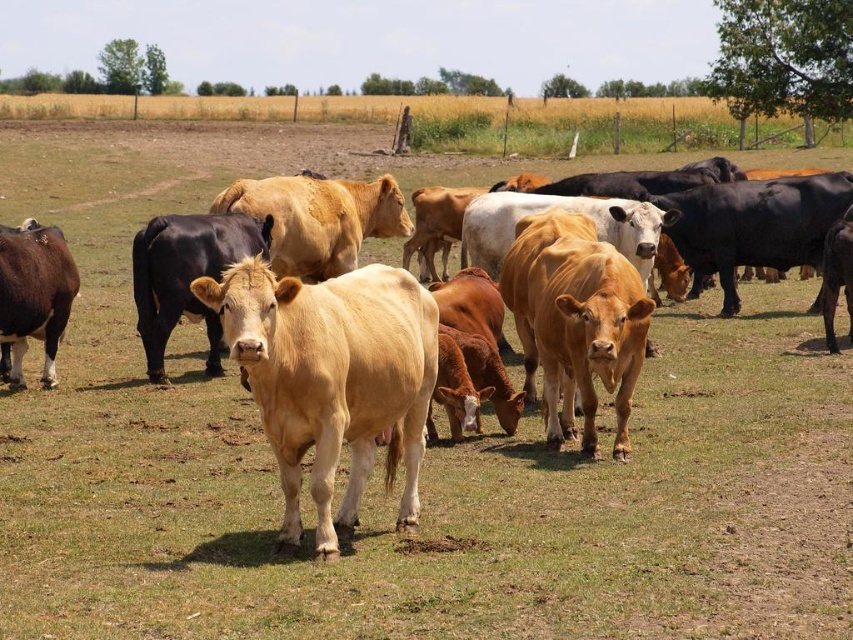
You are a farmer checking the field and need to locate the shiny black bull at center. According to the coordinates provided, where exactly is the shiny black bull positioned in the image?

The shiny black bull at center is located at point (186, 275), which means it is positioned slightly to the right and lower middle of the image.

Consider the image. You are a farmer checking the field. You notice the shiny black bull at center and the brown glossy cow at left. Which animal is closer to the fence that separates the grassy field from the golden wheat field in the background?

The shiny black bull at center is closer to the fence because it is positioned over the brown glossy cow at left, which is farther away from the fence.

You are a farmer checking the field. You see the shiny black bull at center and the brown glossy cow at left. Which cow is positioned more to the east if the sun is setting in the west?

The brown glossy cow at left is positioned more to the east because the shiny black bull at center is to the right of it, and since the sun is setting in the west, the right side of the image faces west while the left side faces east.